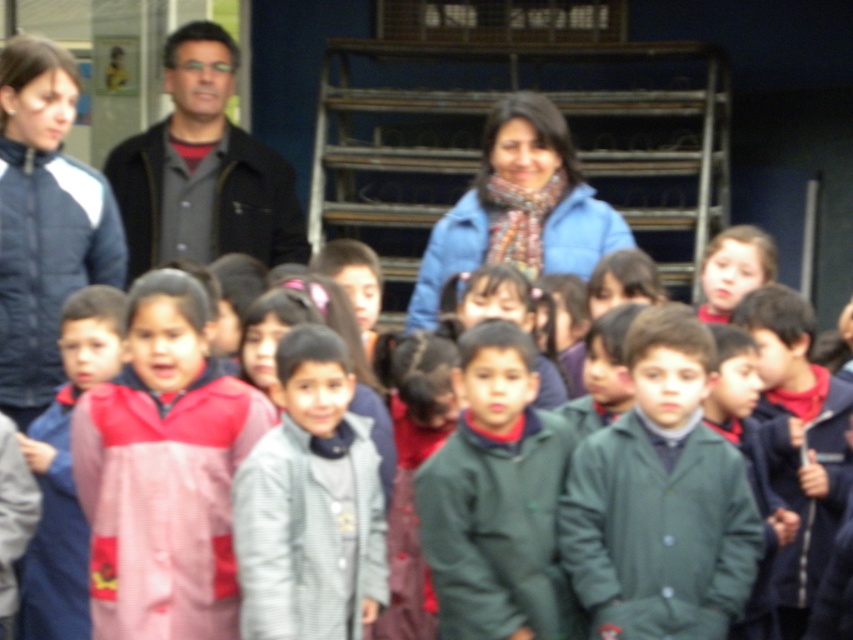
Can you confirm if dark gray jacket at upper center is wider than blue fleece jacket at center?

No.

Does point (196, 20) come farther from viewer compared to point (477, 193)?

Yes, it is behind point (477, 193).

Which is in front, point (283, 189) or point (460, 262)?

Point (460, 262)

Where is `dark gray jacket at upper center`? This screenshot has width=853, height=640. dark gray jacket at upper center is located at coordinates (202, 170).

Is green woolen coat at center thinner than dark gray jacket at upper center?

No.

Is green woolen coat at center closer to camera compared to dark gray jacket at upper center?

Yes, it is.

Does point (654, 467) come behind point (231, 179)?

No, (654, 467) is in front of (231, 179).

Where is `green woolen coat at center`? The height and width of the screenshot is (640, 853). green woolen coat at center is located at coordinates (659, 532).

Does green matte jacket at center appear on the left side of blue fleece jacket at center?

No, green matte jacket at center is not to the left of blue fleece jacket at center.

Which is behind, point (444, 538) or point (428, 280)?

The point (428, 280) is behind.

Who is more forward, (444,557) or (448,240)?

Positioned in front is point (444,557).

This screenshot has height=640, width=853. What are the coordinates of `green matte jacket at center` in the screenshot? It's located at pos(497,531).